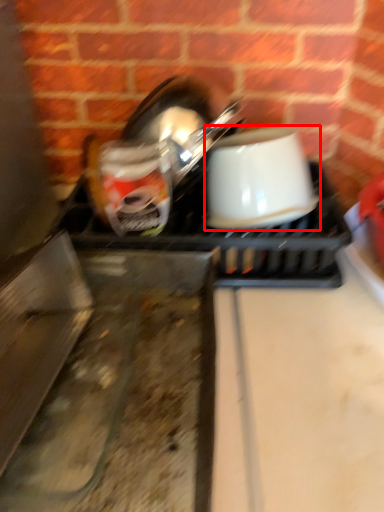
Question: Considering the relative positions of coffee cup (annotated by the red box) and appliance in the image provided, where is coffee cup (annotated by the red box) located with respect to the staircase?

Choices:
 (A) left
 (B) right

Answer: (B)